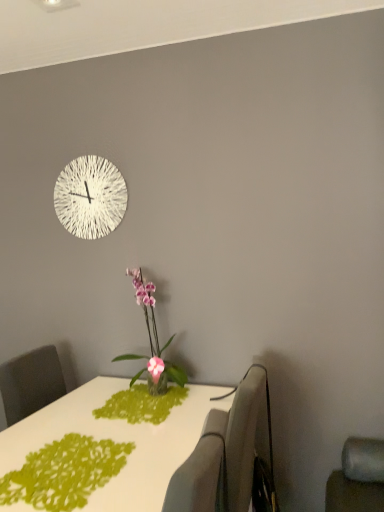
Question: Is gray fabric swivel chair at right, placed as the 1th swivel chair when sorted from back to front, inside the boundaries of pink glossy orchid at center, or outside?

Choices:
 (A) outside
 (B) inside

Answer: (A)

Question: Is point (274, 505) positioned closer to the camera than point (157, 338)?

Choices:
 (A) farther
 (B) closer

Answer: (B)

Question: Estimate the real-world distances between objects in this image. Which object is closer to the white glossy table at center?

Choices:
 (A) gray fabric swivel chair at right, acting as the second swivel chair starting from the front
 (B) green paper doily at lower left
 (C) pink glossy orchid at center
 (D) white textured clock at upper center
 (E) fabric swivel chair at lower center, marked as the first swivel chair in a front-to-back arrangement

Answer: (B)

Question: Which object is positioned closest to the pink glossy orchid at center?

Choices:
 (A) gray fabric swivel chair at right, placed as the 1th swivel chair when sorted from back to front
 (B) white textured clock at upper center
 (C) fabric swivel chair at lower center, which ranks as the 2th swivel chair in back-to-front order
 (D) green paper doily at lower left
 (E) white glossy table at center

Answer: (E)